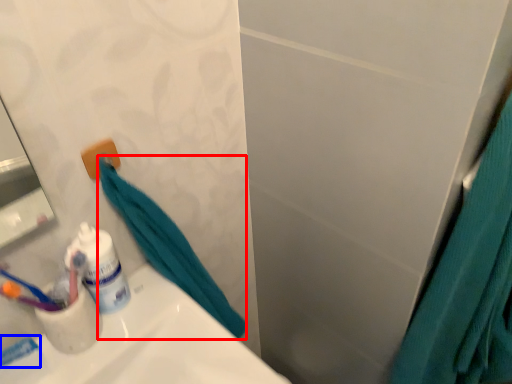
Question: Which point is closer to the camera, bath towel (highlighted by a red box) or toothpaste (highlighted by a blue box)?

Choices:
 (A) bath towel
 (B) toothpaste

Answer: (A)